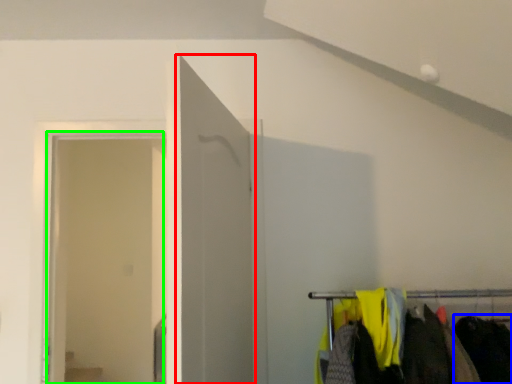
Question: Which is nearer to the door (highlighted by a red box)? clothing (highlighted by a blue box) or glass door (highlighted by a green box).

Choices:
 (A) clothing
 (B) glass door

Answer: (A)